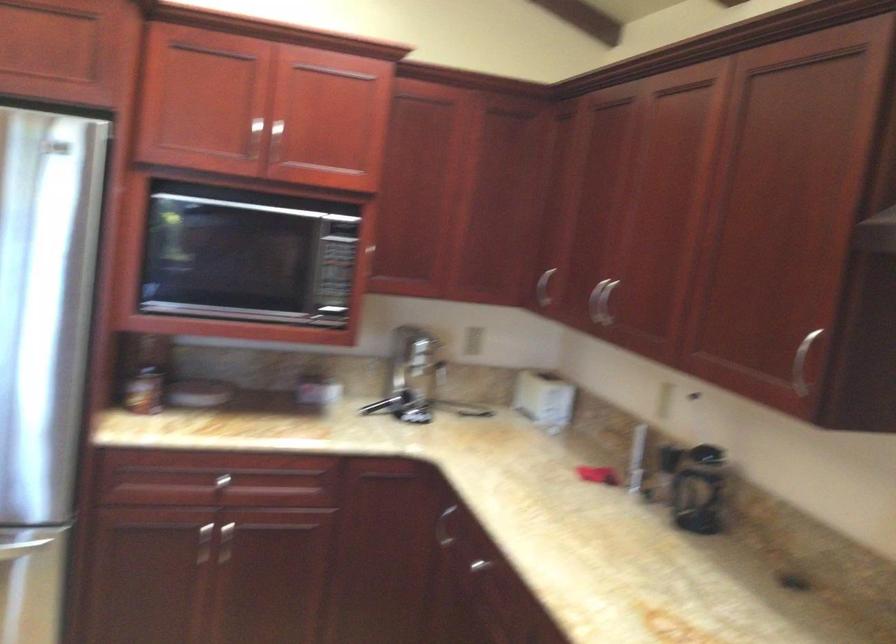
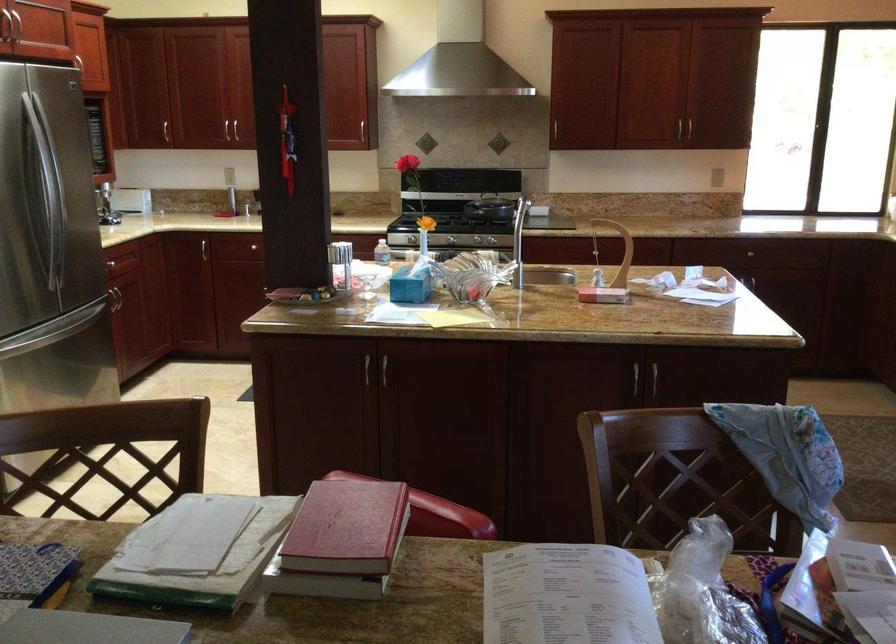
The point at (x=660, y=498) is marked in the first image. Where is the corresponding point in the second image?

(202, 205)